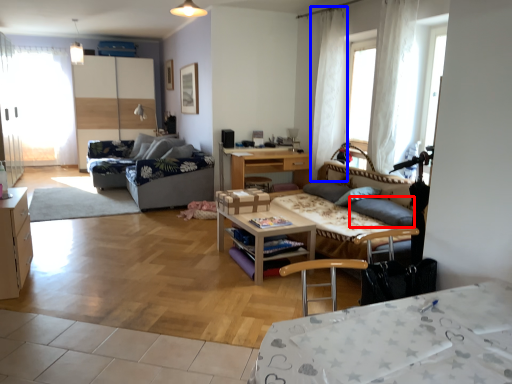
Question: Which object is closer to the camera taking this photo, gray (highlighted by a red box) or curtain (highlighted by a blue box)?

Choices:
 (A) gray
 (B) curtain

Answer: (A)